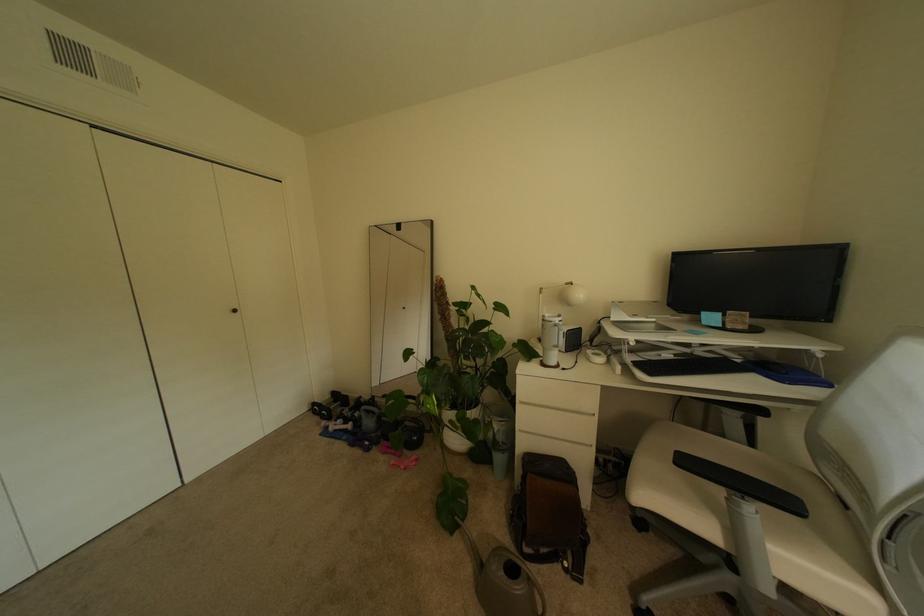
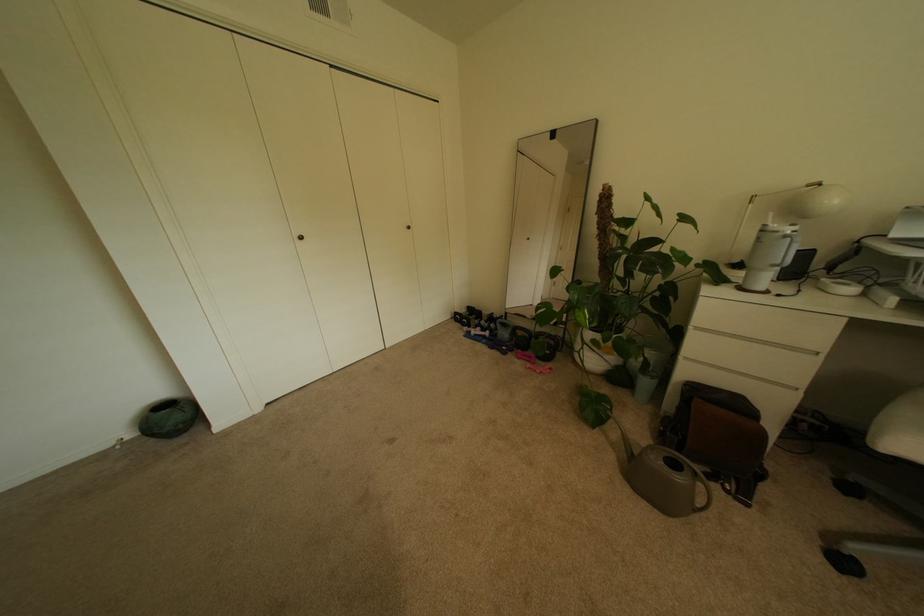
Locate, in the second image, the point that corresponds to point (391, 440) in the first image.

(524, 350)